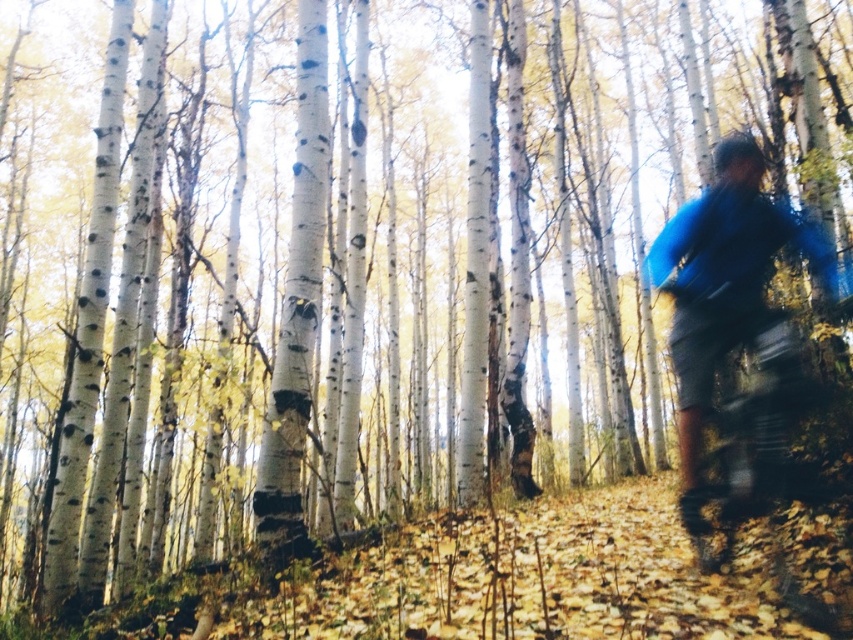
Question: Which of the following is the closest to the observer?

Choices:
 (A) metallic silver mountain bike at right
 (B) blue fabric jacket at right

Answer: (A)

Question: Which point is farther from the camera taking this photo?

Choices:
 (A) (704, 502)
 (B) (683, 444)

Answer: (B)

Question: Can you confirm if blue fabric jacket at right is positioned to the right of metallic silver mountain bike at right?

Choices:
 (A) no
 (B) yes

Answer: (A)

Question: From the image, what is the correct spatial relationship of blue fabric jacket at right in relation to metallic silver mountain bike at right?

Choices:
 (A) above
 (B) below

Answer: (A)

Question: Is blue fabric jacket at right positioned behind metallic silver mountain bike at right?

Choices:
 (A) yes
 (B) no

Answer: (A)

Question: Among these points, which one is nearest to the camera?

Choices:
 (A) (683, 250)
 (B) (785, 413)

Answer: (B)